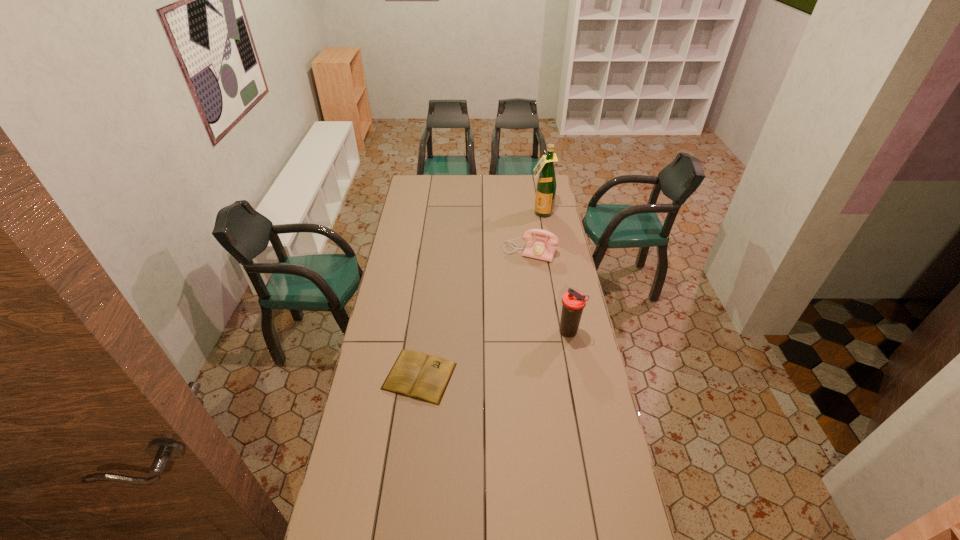
In order to click on free space on the desktop that is between the leftmost object and the thermos bottle and is positioned on the dial of the third nearest object in this screenshot , I will do `click(486, 356)`.

This screenshot has width=960, height=540. I want to click on free space on the desktop that is between the leftmost object and the second nearest object and is positioned on the front-facing side of the farthest object, so click(x=499, y=353).